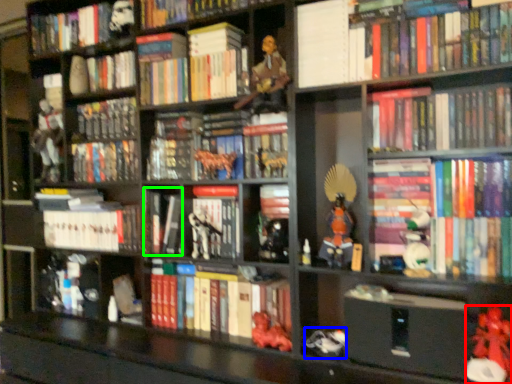
Question: Based on their relative distances, which object is farther from toy (highlighted by a red box)? Choose from toy (highlighted by a blue box) and book (highlighted by a green box).

Choices:
 (A) toy
 (B) book

Answer: (B)